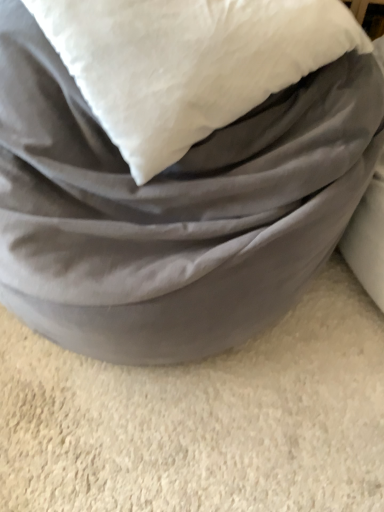
Question: From a real-world perspective, does matte gray bean bag at center stand above white soft pillow at upper center?

Choices:
 (A) yes
 (B) no

Answer: (B)

Question: Does matte gray bean bag at center have a lesser width compared to white soft pillow at upper center?

Choices:
 (A) yes
 (B) no

Answer: (B)

Question: From a real-world perspective, is matte gray bean bag at center positioned under white soft pillow at upper center based on gravity?

Choices:
 (A) no
 (B) yes

Answer: (B)

Question: Is white soft pillow at upper center a part of matte gray bean bag at center?

Choices:
 (A) yes
 (B) no

Answer: (A)

Question: Can you confirm if matte gray bean bag at center is wider than white soft pillow at upper center?

Choices:
 (A) yes
 (B) no

Answer: (A)

Question: Does matte gray bean bag at center come in front of white soft pillow at upper center?

Choices:
 (A) no
 (B) yes

Answer: (B)

Question: From a real-world perspective, does white soft pillow at upper center stand above matte gray bean bag at center?

Choices:
 (A) no
 (B) yes

Answer: (B)

Question: Is white soft pillow at upper center wider than matte gray bean bag at center?

Choices:
 (A) no
 (B) yes

Answer: (A)

Question: Is white soft pillow at upper center at the left side of matte gray bean bag at center?

Choices:
 (A) no
 (B) yes

Answer: (A)

Question: Is white soft pillow at upper center bigger than matte gray bean bag at center?

Choices:
 (A) no
 (B) yes

Answer: (A)

Question: Is matte gray bean bag at center completely or partially inside white soft pillow at upper center?

Choices:
 (A) yes
 (B) no

Answer: (B)

Question: Considering the relative sizes of white soft pillow at upper center and matte gray bean bag at center in the image provided, is white soft pillow at upper center thinner than matte gray bean bag at center?

Choices:
 (A) yes
 (B) no

Answer: (A)

Question: Considering the positions of matte gray bean bag at center and white soft pillow at upper center in the image, is matte gray bean bag at center bigger or smaller than white soft pillow at upper center?

Choices:
 (A) big
 (B) small

Answer: (A)